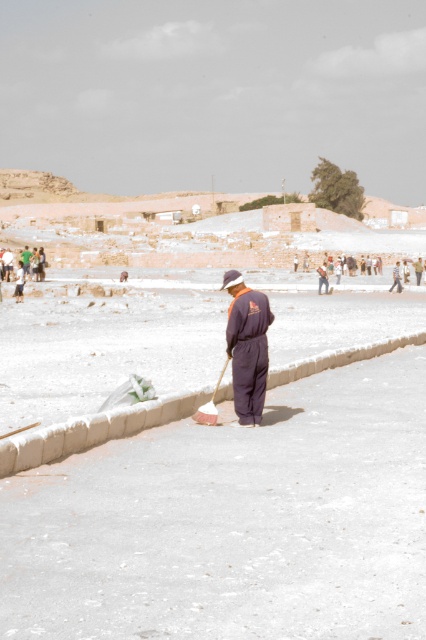
Question: Estimate the real-world distances between objects in this image. Which object is farther from the white plastic shovel at center?

Choices:
 (A) dark blue jumpsuit at center
 (B) white concrete pavement at center

Answer: (B)

Question: Which of the following is the closest to the observer?

Choices:
 (A) dark blue jumpsuit at center
 (B) white plastic shovel at center

Answer: (B)

Question: Can you confirm if white concrete pavement at center is smaller than white plastic shovel at center?

Choices:
 (A) yes
 (B) no

Answer: (B)

Question: Which point is farther to the camera?

Choices:
 (A) (198, 422)
 (B) (273, 612)
 (C) (236, 324)

Answer: (A)

Question: Does dark blue jumpsuit at center have a larger size compared to white plastic shovel at center?

Choices:
 (A) yes
 (B) no

Answer: (B)

Question: Does white concrete pavement at center have a greater width compared to white plastic shovel at center?

Choices:
 (A) no
 (B) yes

Answer: (B)